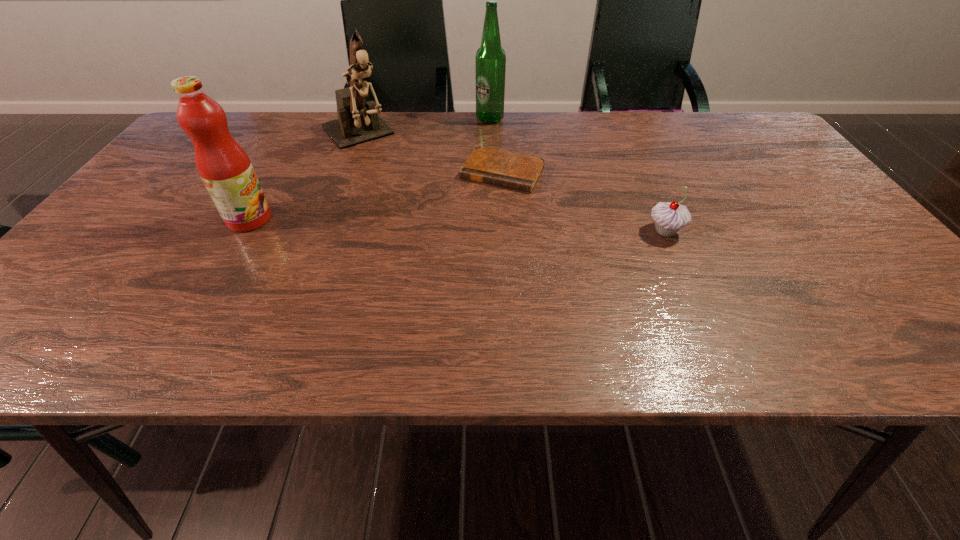
This screenshot has height=540, width=960. Identify the location of vacant space located 0.220m on the spine side of the shortest object. (456, 249).

At what (x,y) coordinates should I click in order to perform the action: click on blank area located on the front-facing side of the figurine. Please return your answer as a coordinate pair (x, y). The image size is (960, 540). Looking at the image, I should click on (413, 202).

I want to click on free spot located on the front-facing side of the figurine, so click(x=437, y=230).

Find the location of a particular element. free space located on the front-facing side of the figurine is located at coordinates (417, 207).

Image resolution: width=960 pixels, height=540 pixels. Identify the location of free region located on the label of the beer bottle. (490, 136).

This screenshot has height=540, width=960. What are the coordinates of `free space located on the label of the beer bottle` in the screenshot? It's located at (490, 150).

Where is `vacant area situated 0.260m on the label of the beer bottle`? The width and height of the screenshot is (960, 540). vacant area situated 0.260m on the label of the beer bottle is located at coordinates (489, 174).

Identify the location of diary that is positioned at the far edge. The image size is (960, 540). (501, 168).

The width and height of the screenshot is (960, 540). What are the coordinates of `figurine at the far edge` in the screenshot? It's located at (358, 122).

You are a GUI agent. You are given a task and a screenshot of the screen. Output one action in this format:
    pyautogui.click(x=<x>, y=<y>)
    Task: Click on the beer bottle present at the far edge
    This screenshot has width=960, height=540.
    Given the screenshot: What is the action you would take?
    pyautogui.click(x=490, y=58)